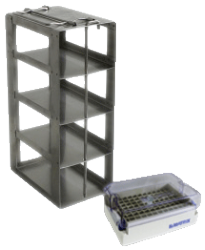
You are a GUI agent. You are given a task and a screenshot of the screen. Output one action in this format:
    pyautogui.click(x=<x>, y=<y>)
    Task: Click on the corner
    
    Given the screenshot: What is the action you would take?
    pyautogui.click(x=104, y=179)